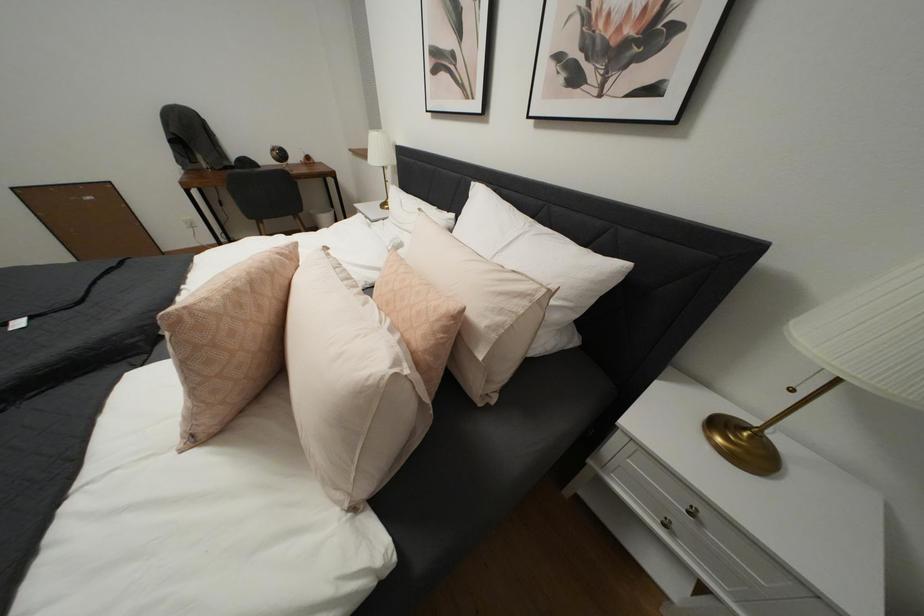
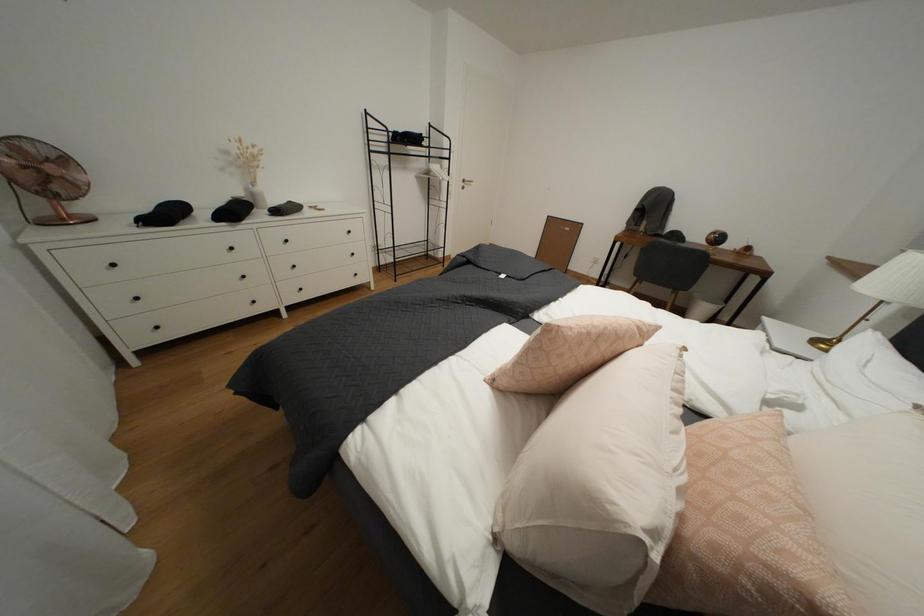
Question: The first image is from the beginning of the video and the second image is from the end. How did the camera likely rotate when shooting the video?

Choices:
 (A) Left
 (B) Right
 (C) Up
 (D) Down

Answer: (A)